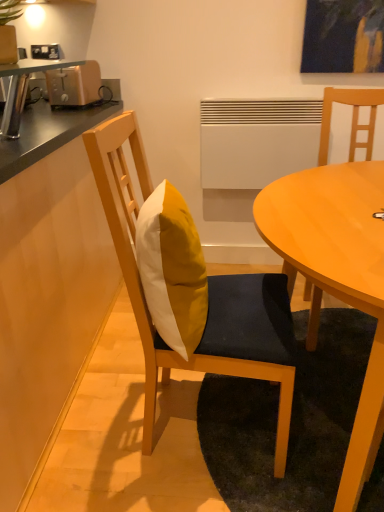
Question: Considering the relative positions of matte wood chair at center, placed as the first chair when sorted from right to left, and yellow fabric pillow at center in the image provided, is matte wood chair at center, placed as the first chair when sorted from right to left, to the right of yellow fabric pillow at center from the viewer's perspective?

Choices:
 (A) no
 (B) yes

Answer: (B)

Question: Is matte wood chair at center, which is the second chair from left to right, in front of yellow fabric pillow at center?

Choices:
 (A) no
 (B) yes

Answer: (A)

Question: Is yellow fabric pillow at center inside matte wood chair at center, placed as the first chair when sorted from right to left?

Choices:
 (A) yes
 (B) no

Answer: (B)

Question: Is matte wood chair at center, placed as the first chair when sorted from right to left, shorter than yellow fabric pillow at center?

Choices:
 (A) yes
 (B) no

Answer: (B)

Question: Is matte wood chair at center, which is the second chair from left to right, facing away from yellow fabric pillow at center?

Choices:
 (A) no
 (B) yes

Answer: (A)

Question: Can you confirm if matte wood chair at center, which is the second chair from left to right, is taller than yellow fabric pillow at center?

Choices:
 (A) no
 (B) yes

Answer: (B)

Question: Is the depth of wooden countertop at left less than that of matte wood chair at center, placed as the first chair when sorted from right to left?

Choices:
 (A) yes
 (B) no

Answer: (A)

Question: Can you confirm if wooden countertop at left is shorter than matte wood chair at center, which is the second chair from left to right?

Choices:
 (A) yes
 (B) no

Answer: (A)

Question: From a real-world perspective, does wooden countertop at left stand above matte wood chair at center, which is the second chair from left to right?

Choices:
 (A) no
 (B) yes

Answer: (A)

Question: Considering the relative sizes of wooden countertop at left and matte wood chair at center, placed as the first chair when sorted from right to left, in the image provided, is wooden countertop at left smaller than matte wood chair at center, placed as the first chair when sorted from right to left,?

Choices:
 (A) no
 (B) yes

Answer: (A)

Question: Considering the relative positions of wooden countertop at left and matte wood chair at center, placed as the first chair when sorted from right to left, in the image provided, is wooden countertop at left to the left of matte wood chair at center, placed as the first chair when sorted from right to left, from the viewer's perspective?

Choices:
 (A) yes
 (B) no

Answer: (A)

Question: Can you confirm if wooden countertop at left is taller than matte wood chair at center, which is the second chair from left to right?

Choices:
 (A) no
 (B) yes

Answer: (A)

Question: Is matte wood table at center located within yellow fabric cushion at center, marked as the second chair in a right-to-left arrangement?

Choices:
 (A) yes
 (B) no

Answer: (B)